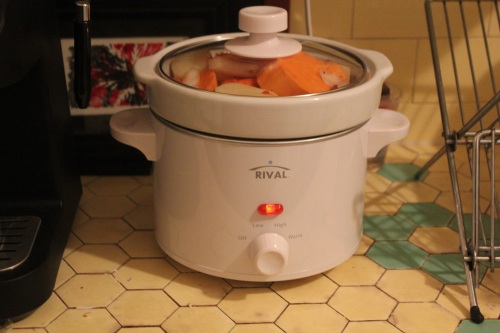
I want to click on wall, so click(360, 29).